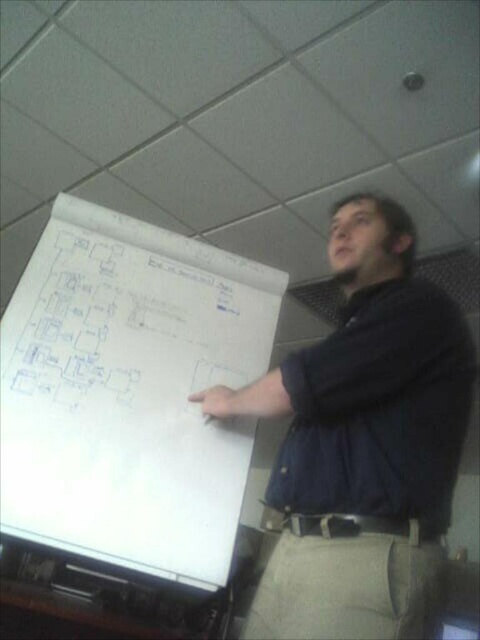
Question: Does dark blue shirt at upper center appear on the left side of dark blue fabric shirt at right?

Choices:
 (A) no
 (B) yes

Answer: (B)

Question: Which point is farther to the camera?

Choices:
 (A) white paper at center
 (B) dark blue fabric shirt at right

Answer: (A)

Question: Is white paper at center bigger than dark blue shirt at upper center?

Choices:
 (A) yes
 (B) no

Answer: (B)

Question: Which object is the closest to the blue ink drawing at upper left?

Choices:
 (A) white paper at center
 (B) dark blue fabric shirt at right
 (C) dark blue shirt at upper center

Answer: (A)

Question: Can you confirm if white paper at center is positioned to the right of dark blue shirt at upper center?

Choices:
 (A) no
 (B) yes

Answer: (A)

Question: Which point is closer to the camera?

Choices:
 (A) dark blue shirt at upper center
 (B) dark blue fabric shirt at right
 (C) blue ink drawing at upper left
 (D) white paper at center

Answer: (A)